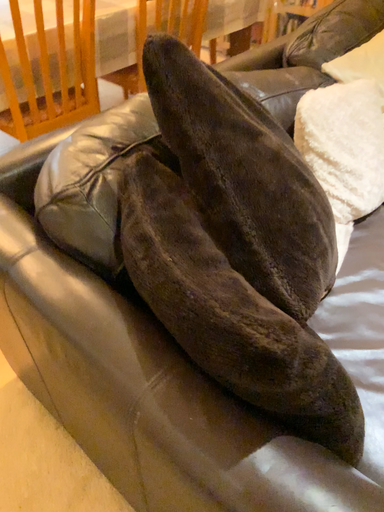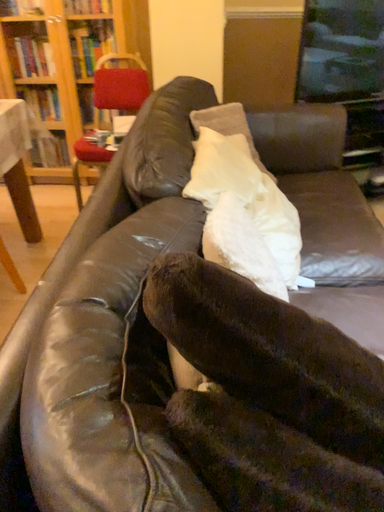
Question: How did the camera likely rotate when shooting the video?

Choices:
 (A) rotated upward
 (B) rotated downward

Answer: (A)